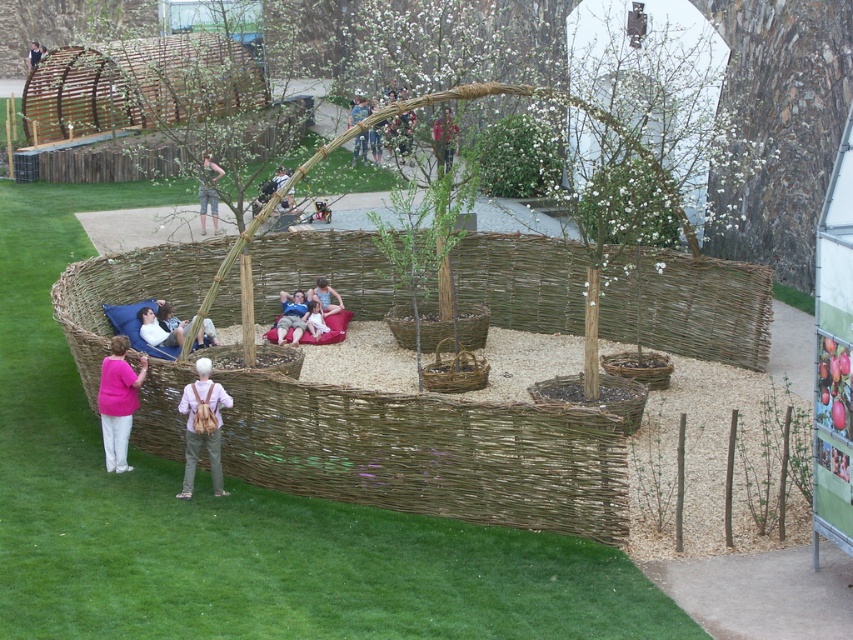
Which is more to the right, pink fabric at lower left or brown woven basket at center?

brown woven basket at center is more to the right.

Does pink fabric at lower left appear on the right side of brown woven basket at center?

No, pink fabric at lower left is not to the right of brown woven basket at center.

At what (x,y) coordinates should I click in order to perform the action: click on pink fabric at lower left. Please return your answer as a coordinate pair (x, y). Looking at the image, I should click on (119, 401).

Is point (202, 381) positioned behind point (318, 314)?

No.

Where is `khaki pants at lower center`? The image size is (853, 640). khaki pants at lower center is located at coordinates (202, 426).

Who is positioned more to the left, woven brown basket at lower right or blue fabric cushion at center?

From the viewer's perspective, blue fabric cushion at center appears more on the left side.

Describe the element at coordinates (639, 365) in the screenshot. I see `woven brown basket at lower right` at that location.

In order to click on woven brown basket at lower right in this screenshot , I will do `click(639, 365)`.